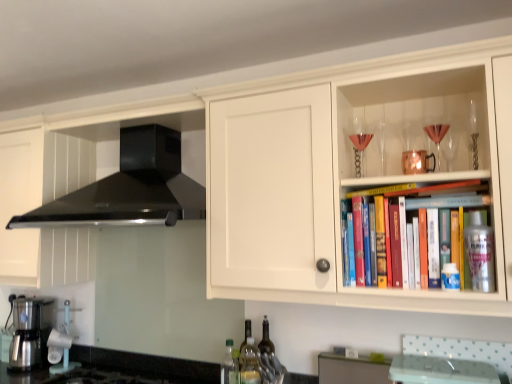
Question: Should I look upward or downward to see metallic silver spray can at upper right, arranged as the 1th bottle when viewed from the front?

Choices:
 (A) down
 (B) up

Answer: (A)

Question: From a real-world perspective, is black granite countertop at lower left physically below translucent glass wine glass at upper right, arranged as the 2th wine glass when viewed from the left?

Choices:
 (A) yes
 (B) no

Answer: (A)

Question: Considering the relative sizes of black granite countertop at lower left and translucent glass wine glass at upper right, the 1th wine glass in the right-to-left sequence, in the image provided, is black granite countertop at lower left wider than translucent glass wine glass at upper right, the 1th wine glass in the right-to-left sequence,?

Choices:
 (A) yes
 (B) no

Answer: (A)

Question: Can you confirm if black granite countertop at lower left is smaller than translucent glass wine glass at upper right, which appears as the second wine glass when viewed from the back?

Choices:
 (A) yes
 (B) no

Answer: (B)

Question: Is black granite countertop at lower left at the right side of translucent glass wine glass at upper right, arranged as the 1th wine glass when viewed from the front?

Choices:
 (A) no
 (B) yes

Answer: (A)

Question: Is black granite countertop at lower left thinner than translucent glass wine glass at upper right, which appears as the second wine glass when viewed from the back?

Choices:
 (A) no
 (B) yes

Answer: (A)

Question: Considering the relative sizes of black granite countertop at lower left and translucent glass wine glass at upper right, arranged as the 2th wine glass when viewed from the left, in the image provided, is black granite countertop at lower left taller than translucent glass wine glass at upper right, arranged as the 2th wine glass when viewed from the left,?

Choices:
 (A) yes
 (B) no

Answer: (A)

Question: Does green plastic bottle at lower center, which ranks as the 3th bottle in back-to-front order, have a lesser width compared to white wood cabinet at upper right, the second cabinetry positioned from the bottom?

Choices:
 (A) no
 (B) yes

Answer: (B)

Question: Is green plastic bottle at lower center, acting as the first bottle starting from the left, oriented away from white wood cabinet at upper right, the second cabinetry positioned from the bottom?

Choices:
 (A) no
 (B) yes

Answer: (A)

Question: From the image's perspective, is green plastic bottle at lower center, which ranks as the 3th bottle in back-to-front order, located beneath white wood cabinet at upper right, placed as the 1th cabinetry when sorted from front to back?

Choices:
 (A) yes
 (B) no

Answer: (A)

Question: Is green plastic bottle at lower center, the second bottle when ordered from front to back, not close to white wood cabinet at upper right, the second cabinetry positioned from the bottom?

Choices:
 (A) yes
 (B) no

Answer: (B)

Question: Does green plastic bottle at lower center, the second bottle when ordered from front to back, touch white wood cabinet at upper right, which is counted as the 2th cabinetry, starting from the right?

Choices:
 (A) yes
 (B) no

Answer: (B)

Question: Is white wood cabinet at upper right, marked as the first cabinetry in a left-to-right arrangement, a part of green plastic bottle at lower center, the second bottle when ordered from front to back?

Choices:
 (A) yes
 (B) no

Answer: (B)

Question: Is the position of metallic silver spray can at upper right, the 4th bottle positioned from the left, more distant than that of translucent glass bottle at lower center, arranged as the 1th bottle when viewed from the back?

Choices:
 (A) yes
 (B) no

Answer: (B)